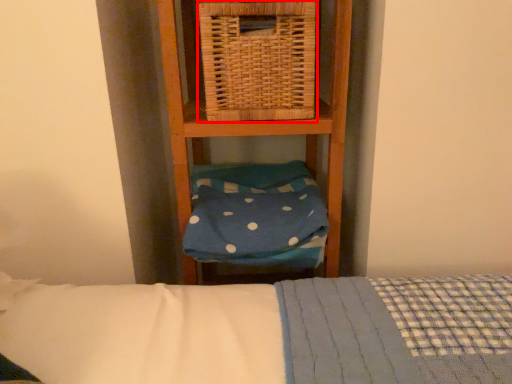
Question: Observing the image, what is the correct spatial positioning of picnic basket (annotated by the red box) in reference to pillow?

Choices:
 (A) right
 (B) left

Answer: (A)